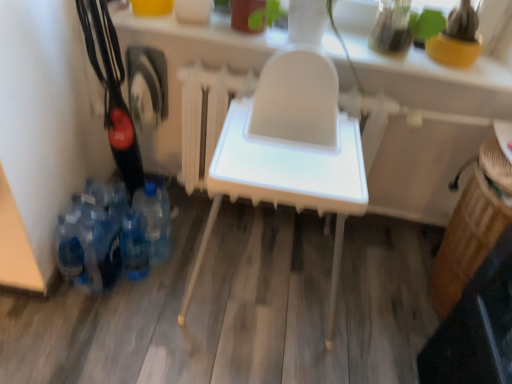
What are the coordinates of `vacant space to the right of blue plastic bottle at lower left, arranged as the first bottle when viewed from the right` in the screenshot? It's located at (193, 260).